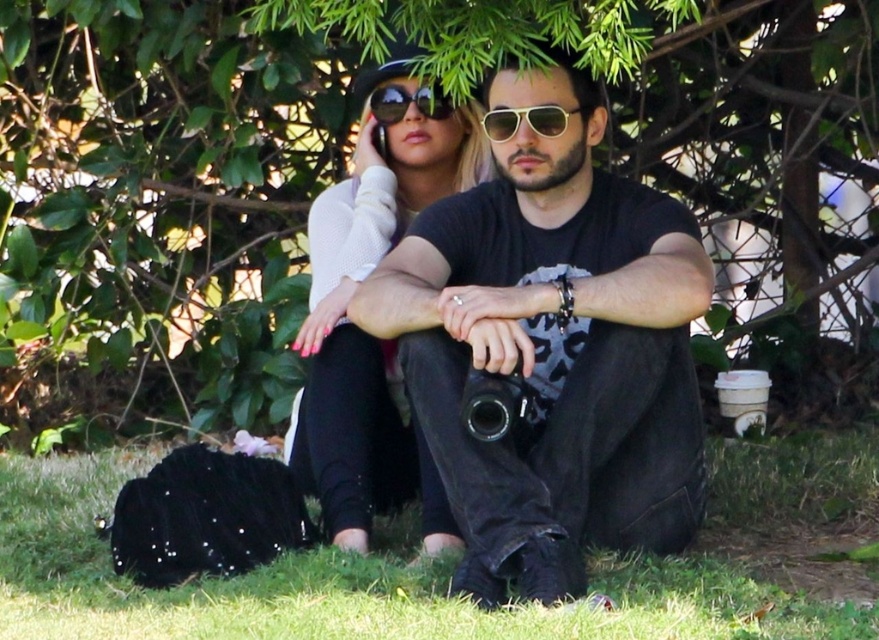
You are a photographer trying to capture a closeup of the gold reflective aviator sunglasses at center. Since the green grass at lower center is in the way, can you adjust your camera angle to avoid the grass while still focusing on the sunglasses?

The green grass at lower center is located below the gold reflective aviator sunglasses at center, so you can tilt your camera upwards to focus on the sunglasses while avoiding the grass below.

You are taking a photo of two people sitting under a tree. You want to focus on the person closer to the camera. Which point should you focus on, point [13,182] or point [438,125]?

Point [13,182] is further to the camera than point [438,125], so you should focus on point [13,182] to capture the person closer to the camera.